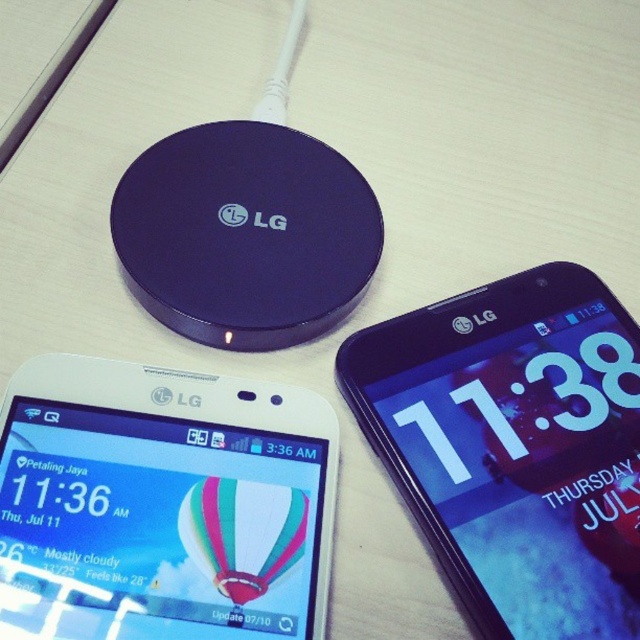
Question: Which object appears closest to the camera in this image?

Choices:
 (A) purple glossy lg wireless charger at upper center
 (B) white glossy phone at lower left
 (C) black glossy smartphone at upper right

Answer: (B)

Question: Does white glossy phone at lower left appear on the left side of purple glossy lg wireless charger at upper center?

Choices:
 (A) no
 (B) yes

Answer: (B)

Question: Does black glossy smartphone at upper right have a larger size compared to purple glossy lg wireless charger at upper center?

Choices:
 (A) no
 (B) yes

Answer: (B)

Question: Which point is farther from the camera taking this photo?

Choices:
 (A) (246, 150)
 (B) (486, 352)
 (C) (236, 600)

Answer: (A)

Question: Which object appears closest to the camera in this image?

Choices:
 (A) black glossy smartphone at upper right
 (B) purple glossy lg wireless charger at upper center
 (C) white glossy phone at lower left

Answer: (C)

Question: Is white glossy phone at lower left further to camera compared to purple glossy lg wireless charger at upper center?

Choices:
 (A) yes
 (B) no

Answer: (B)